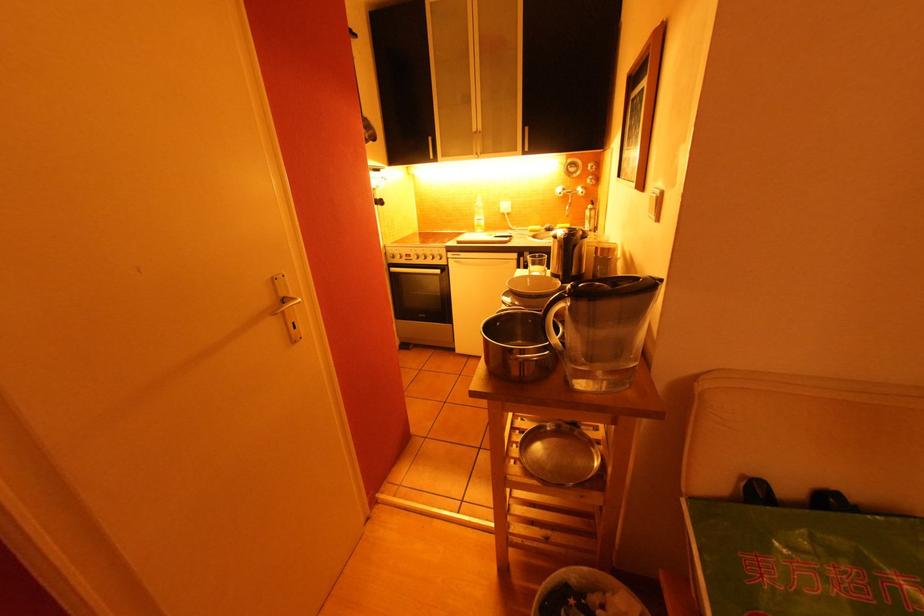
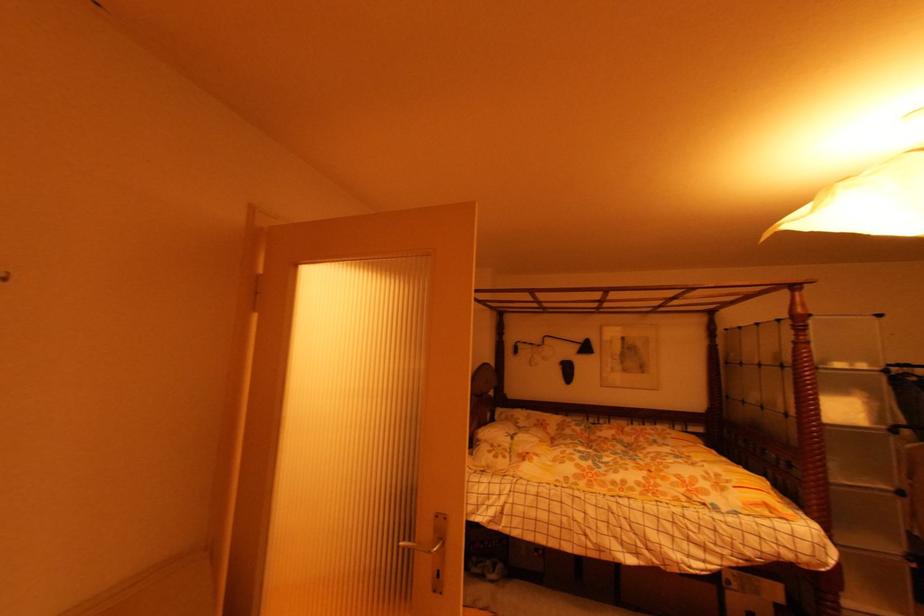
Question: The camera is either moving clockwise (left) or counter-clockwise (right) around the object. The first image is from the beginning of the video and the second image is from the end. Is the camera moving left or right when shooting the video?

Choices:
 (A) Left
 (B) Right

Answer: (A)